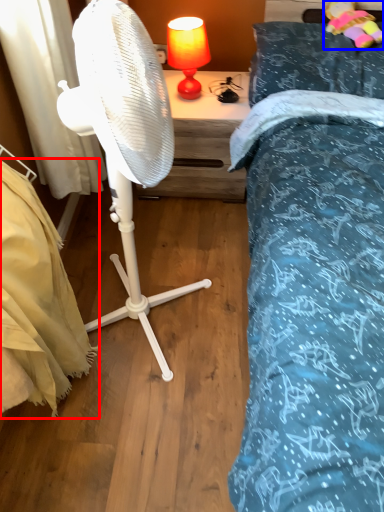
Question: Which point is further to the camera, mattress (highlighted by a red box) or toy (highlighted by a blue box)?

Choices:
 (A) mattress
 (B) toy

Answer: (B)